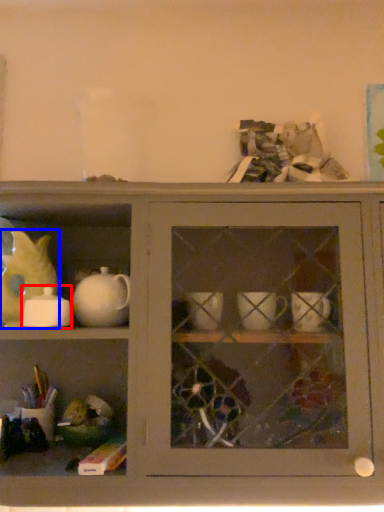
Question: Which of the following is the closest to the observer, tableware (highlighted by a red box) or animal (highlighted by a blue box)?

Choices:
 (A) tableware
 (B) animal

Answer: (A)